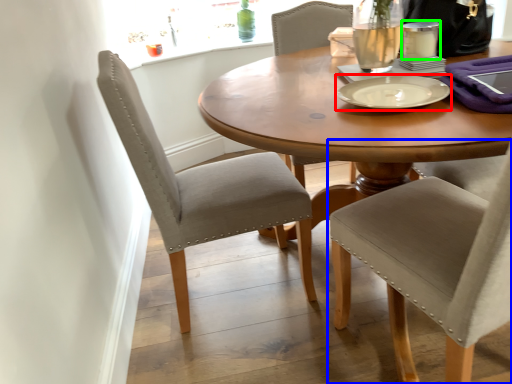
Question: Which object is positioned farthest from tableware (highlighted by a red box)? Select from chair (highlighted by a blue box) and tableware (highlighted by a green box).

Choices:
 (A) chair
 (B) tableware

Answer: (A)